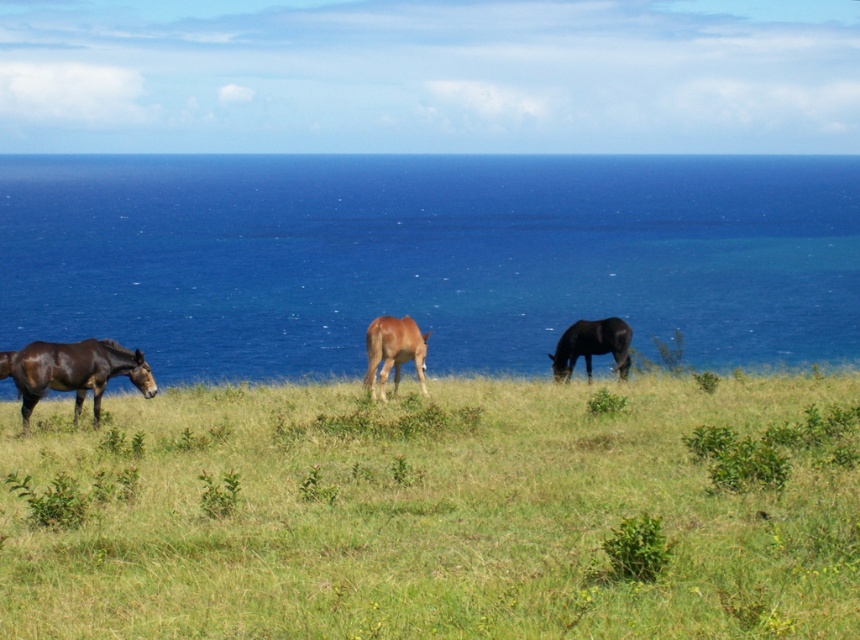
Does shiny brown horse at left have a larger size compared to brown matte horse at center?

Indeed, shiny brown horse at left has a larger size compared to brown matte horse at center.

Does shiny brown horse at left have a greater height compared to brown matte horse at center?

Yes, shiny brown horse at left is taller than brown matte horse at center.

Which is behind, point (97, 392) or point (416, 333)?

Point (416, 333)

Where is `shiny brown horse at left`? This screenshot has height=640, width=860. shiny brown horse at left is located at coordinates (72, 371).

Is brown matte horse at center to the left of black glossy horse at center from the viewer's perspective?

Correct, you'll find brown matte horse at center to the left of black glossy horse at center.

Does point (379, 340) come behind point (585, 336)?

No, it is not.

Where is `brown matte horse at center`? This screenshot has height=640, width=860. brown matte horse at center is located at coordinates (392, 349).

Is green grassy at center bigger than black glossy horse at center?

Correct, green grassy at center is larger in size than black glossy horse at center.

Is green grassy at center positioned before black glossy horse at center?

Yes.

This screenshot has width=860, height=640. What do you see at coordinates (435, 513) in the screenshot?
I see `green grassy at center` at bounding box center [435, 513].

The image size is (860, 640). I want to click on green grassy at center, so click(435, 513).